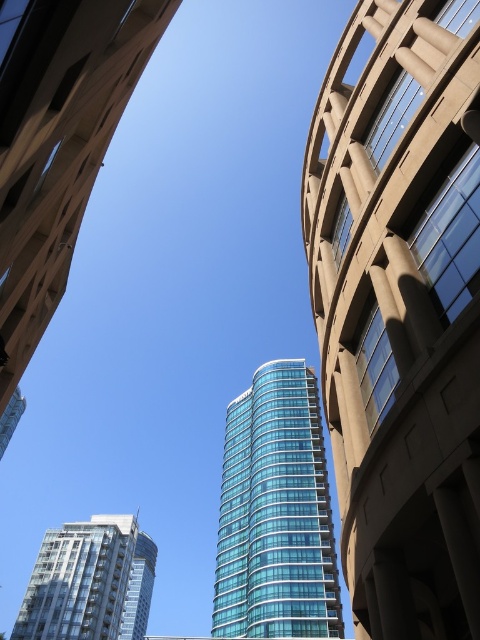
Identify the location of transparent glass building at center. point(276,513).

Is transparent glass building at center further to the viewer compared to glassy teal tower at lower left?

No.

Measure the distance between transparent glass building at center and camera.

The distance of transparent glass building at center from camera is 67.18 meters.

Identify the location of transparent glass building at center. The image size is (480, 640). (276, 513).

Does glassy teal tower at center appear over glassy teal tower at lower left?

Indeed, glassy teal tower at center is positioned over glassy teal tower at lower left.

Which is more to the left, glassy teal tower at center or glassy teal tower at lower left?

From the viewer's perspective, glassy teal tower at lower left appears more on the left side.

The height and width of the screenshot is (640, 480). What do you see at coordinates (400, 310) in the screenshot?
I see `glassy teal tower at center` at bounding box center [400, 310].

The width and height of the screenshot is (480, 640). Find the location of `glassy teal tower at center`. glassy teal tower at center is located at coordinates (400, 310).

Can you confirm if glassy teal tower at center is thinner than transparent glass tower at upper center?

Yes.

Between point (312, 236) and point (43, 141), which one is positioned in front?

Positioned in front is point (43, 141).

Identify the location of glassy teal tower at center. (400, 310).

At what (x,y) coordinates should I click in order to perform the action: click on glassy teal tower at center. Please return your answer as a coordinate pair (x, y). Looking at the image, I should click on (400, 310).